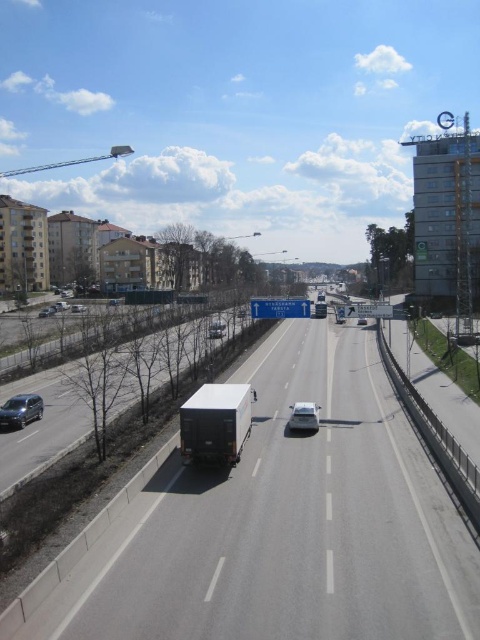
Question: Does white matte truck at left have a greater width compared to white glossy sedan at center?

Choices:
 (A) yes
 (B) no

Answer: (A)

Question: Does shiny black sedan at lower left have a lesser width compared to silver metallic sedan at lower left?

Choices:
 (A) no
 (B) yes

Answer: (B)

Question: Estimate the real-world distances between objects in this image. Which object is farther from the silver metallic sedan at lower left?

Choices:
 (A) white matte truck at left
 (B) white glossy sedan at center
 (C) white matte trailer truck at center

Answer: (C)

Question: In this image, where is white matte truck at left located relative to shiny black sedan at lower left?

Choices:
 (A) below
 (B) above

Answer: (A)

Question: Which object is closer to the camera taking this photo?

Choices:
 (A) shiny silver sedan at center
 (B) silver metallic sedan at center
 (C) white matte trailer truck at center

Answer: (C)

Question: Which is farther from the white glossy sedan at center?

Choices:
 (A) silver metallic sedan at lower left
 (B) white matte truck at left

Answer: (A)